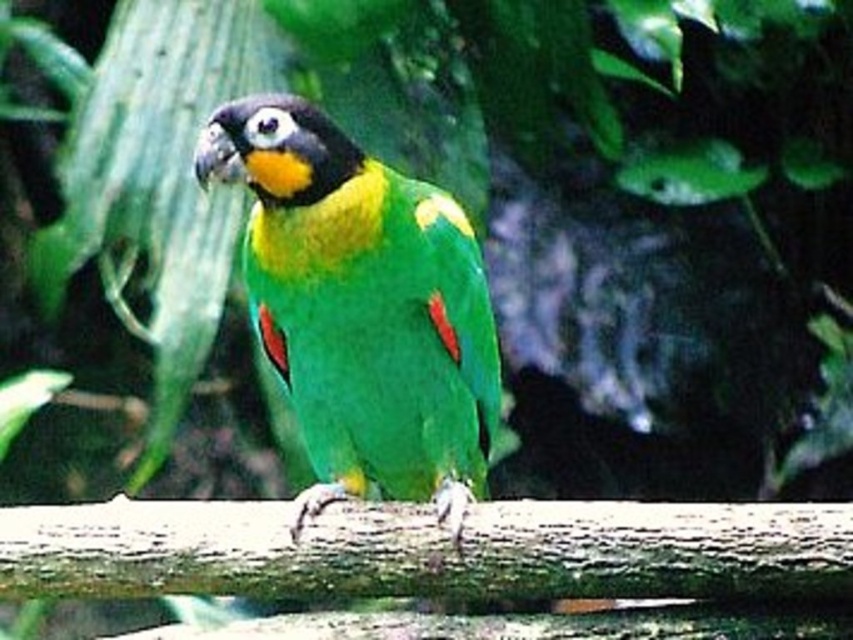
Is point (436, 472) positioned in front of point (165, 509)?

No, (436, 472) is further to viewer.

Is point (358, 205) less distant than point (686, 573)?

No, it is not.

Where is `green matte parrot at center`? This screenshot has width=853, height=640. green matte parrot at center is located at coordinates (363, 307).